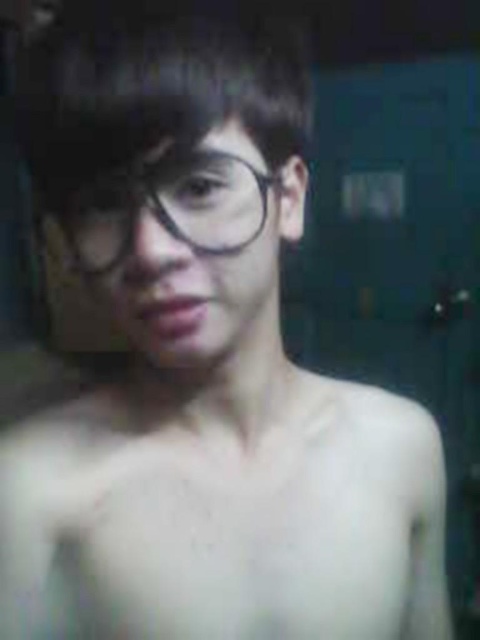
Is skinny white skin at center below clear plastic glasses at center?

Correct, skinny white skin at center is located below clear plastic glasses at center.

I want to click on skinny white skin at center, so click(x=227, y=522).

Between point (416, 618) and point (204, 177), which one is positioned in front?

Point (204, 177) is in front.

Where is `skinny white skin at center`? skinny white skin at center is located at coordinates (227, 522).

Is matte black glasses at center shorter than clear plastic glasses at center?

Incorrect, matte black glasses at center's height does not fall short of clear plastic glasses at center's.

Can you confirm if matte black glasses at center is positioned below clear plastic glasses at center?

Yes.

Does point (192, 246) lie behind point (212, 173)?

That is False.

The width and height of the screenshot is (480, 640). I want to click on matte black glasses at center, so click(x=179, y=240).

Does skinny white skin at center have a greater height compared to matte black glasses at center?

Indeed, skinny white skin at center has a greater height compared to matte black glasses at center.

Between skinny white skin at center and matte black glasses at center, which one is positioned higher?

Positioned higher is matte black glasses at center.

Image resolution: width=480 pixels, height=640 pixels. In order to click on skinny white skin at center in this screenshot , I will do `click(227, 522)`.